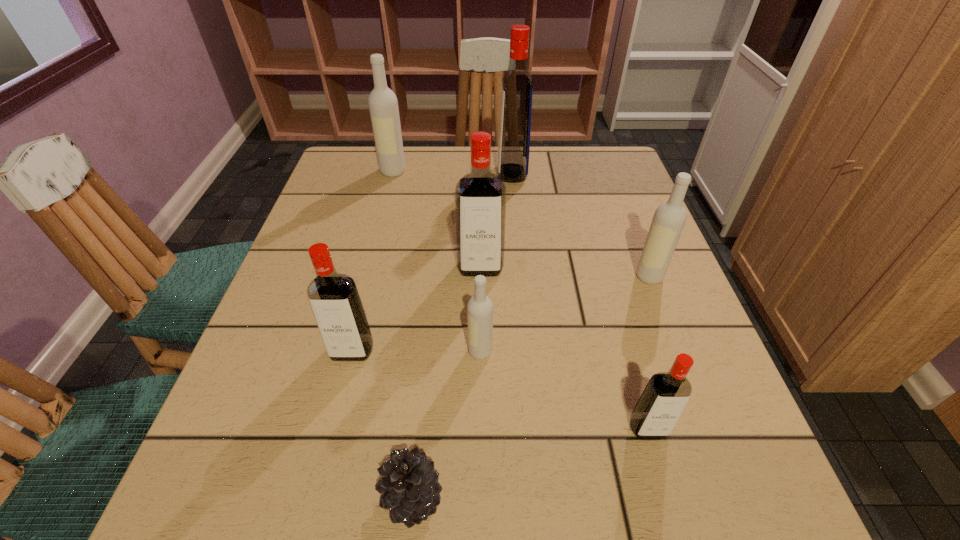
Find the location of a particular element. This screenshot has width=960, height=540. the nearest vodka is located at coordinates (659, 407).

You are a GUI agent. You are given a task and a screenshot of the screen. Output one action in this format:
    pyautogui.click(x=<x>, y=<y>)
    Task: Click on the smallest white vodka
    This screenshot has width=960, height=540.
    Given the screenshot: What is the action you would take?
    pyautogui.click(x=480, y=307)

At what (x,y) coordinates should I click in order to perform the action: click on the nearest white vodka. Please return your answer as a coordinate pair (x, y). Looking at the image, I should click on pos(480,307).

Image resolution: width=960 pixels, height=540 pixels. Find the location of `the sixth object from right to left`. the sixth object from right to left is located at coordinates (411, 492).

Where is `pinecone`? pinecone is located at coordinates (411, 492).

Find the location of a particular element. The height and width of the screenshot is (540, 960). free space located on the front and back of the farthest red vodka is located at coordinates (349, 173).

In order to click on free space located 0.390m on the front and back of the farthest red vodka in this screenshot , I will do `click(353, 173)`.

At what (x,y) coordinates should I click in order to perform the action: click on free point located on the front and back of the farthest red vodka. Please return your answer as a coordinate pair (x, y). This screenshot has width=960, height=540. Looking at the image, I should click on (416, 173).

Where is `free space located 0.330m on the right of the biggest white vodka`? free space located 0.330m on the right of the biggest white vodka is located at coordinates (528, 171).

Find the location of a particular element. This screenshot has height=540, width=960. blank space located on the front and back of the third nearest red vodka is located at coordinates (481, 465).